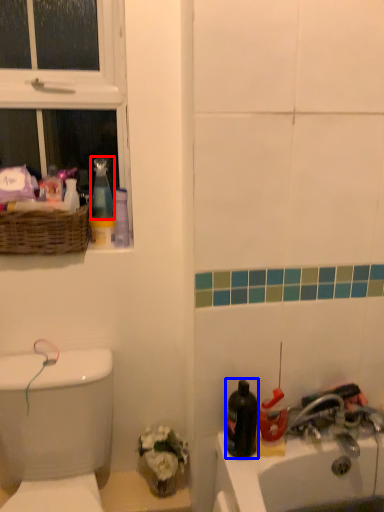
Question: Which object appears farthest to the camera in this image, cleaning product (highlighted by a red box) or mouthwash (highlighted by a blue box)?

Choices:
 (A) cleaning product
 (B) mouthwash

Answer: (A)